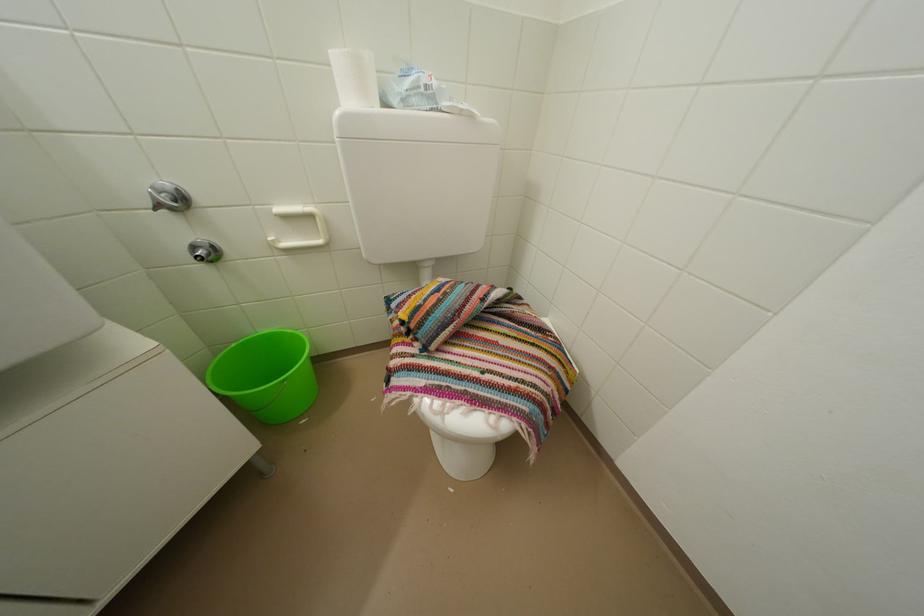
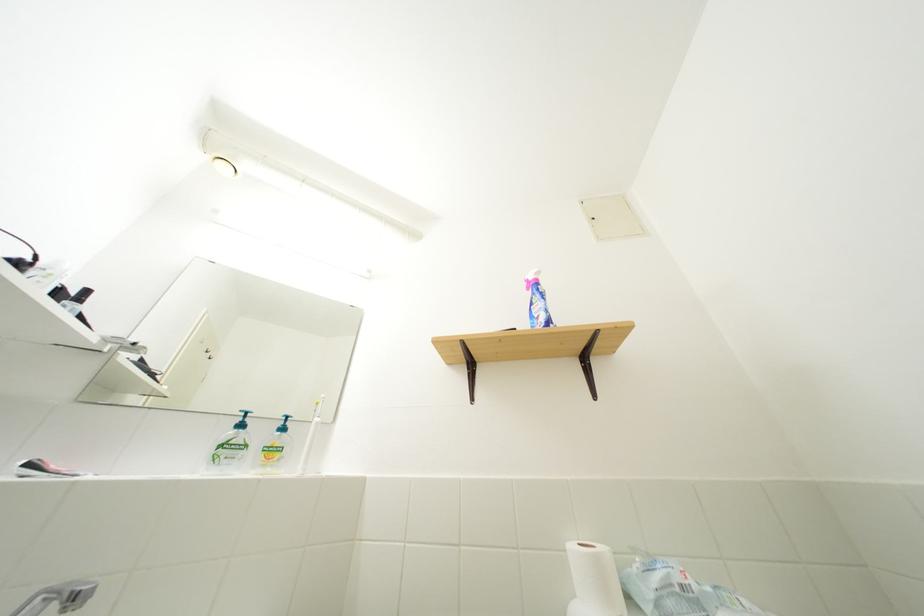
In the second image, find the point that corresponds to [418,87] in the first image.

(665, 585)